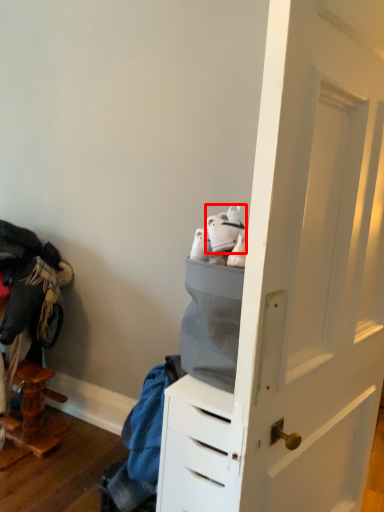
Question: From the image's perspective, what is the correct spatial relationship of footwear (annotated by the red box) in relation to clothing?

Choices:
 (A) below
 (B) above

Answer: (B)